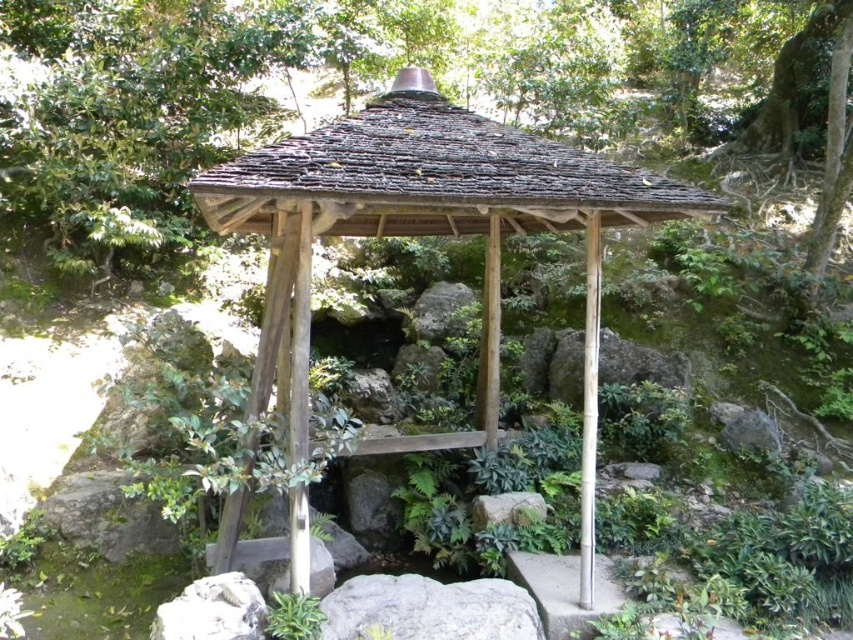
Does green leafy tree at center come behind wooden gazebo at center?

Yes, green leafy tree at center is behind wooden gazebo at center.

Does green leafy tree at center have a larger size compared to wooden gazebo at center?

Indeed, green leafy tree at center has a larger size compared to wooden gazebo at center.

What do you see at coordinates (361, 92) in the screenshot?
I see `green leafy tree at center` at bounding box center [361, 92].

Locate an element on the screen. green leafy tree at center is located at coordinates [x=361, y=92].